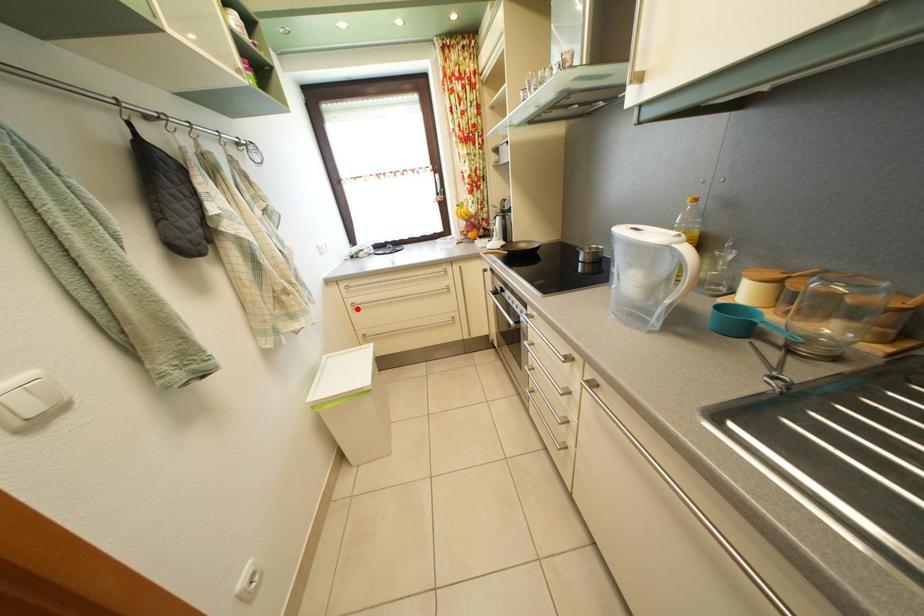
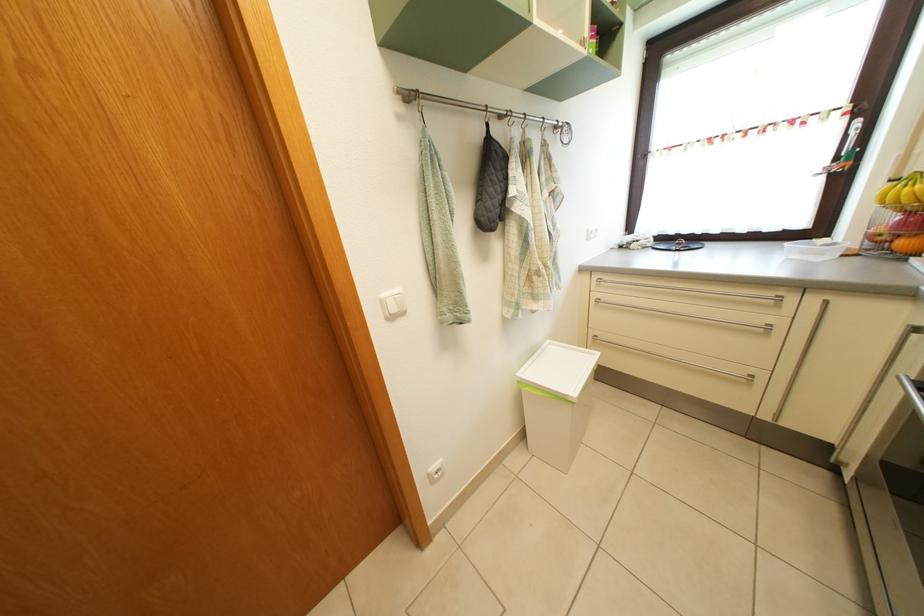
The point at the highlighted location is marked in the first image. Where is the corresponding point in the second image?

(602, 304)